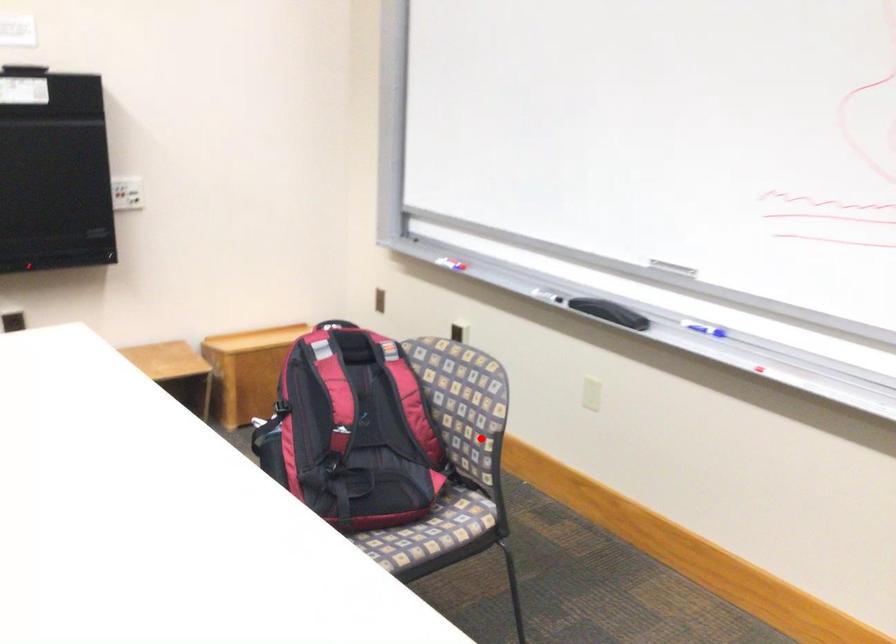
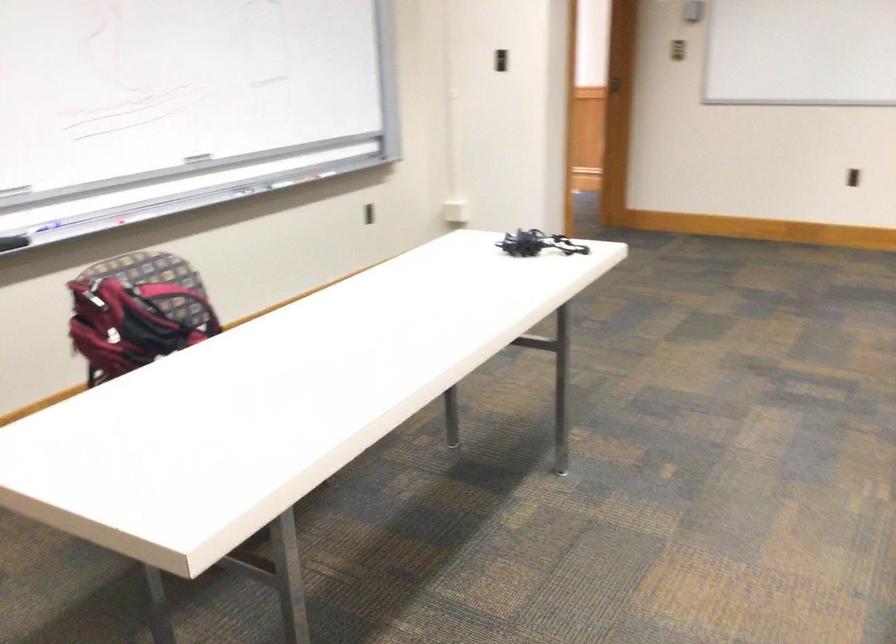
Question: I am providing you with two images of the same scene from different viewpoints. Image1 has a red point marked. In image2, the corresponding 3D location appears at what relative position? Reply with the corresponding letter.

Choices:
 (A) Closer
 (B) Farther

Answer: (B)